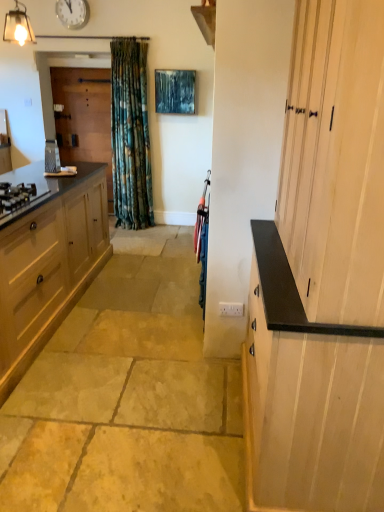
What are the coordinates of `metallic silver grater at left` in the screenshot? It's located at (52, 157).

Measure the distance between point (262, 339) and camera.

1.75 meters.

This screenshot has height=512, width=384. What do you see at coordinates (84, 117) in the screenshot?
I see `wooden screen door at left` at bounding box center [84, 117].

This screenshot has height=512, width=384. What do you see at coordinates (18, 197) in the screenshot?
I see `matte black gas stove at left` at bounding box center [18, 197].

Describe the element at coordinates (127, 397) in the screenshot. I see `natural stone floor at center` at that location.

Find the location of a particular element. The height and width of the screenshot is (512, 384). metallic silver grater at left is located at coordinates (52, 157).

How distant is metallic silver grater at left from matte glass light fixture at upper left?

metallic silver grater at left and matte glass light fixture at upper left are 32.68 inches apart from each other.

Is point (52, 141) closer or farther from the camera than point (10, 40)?

Point (52, 141) is farther from the camera than point (10, 40).

The width and height of the screenshot is (384, 512). Identify the location of appliance on the right of matte glass light fixture at upper left. (52, 157).

Would you consider metallic silver grater at left to be distant from matte glass light fixture at upper left?

Actually, metallic silver grater at left and matte glass light fixture at upper left are a little close together.

Is matte wood cabinet at left, arranged as the 2th cabinetry when viewed from the right, positioned beyond the bounds of natural stone floor at center?

Absolutely, matte wood cabinet at left, arranged as the 2th cabinetry when viewed from the right, is external to natural stone floor at center.

Which of these two, matte wood cabinet at left, the 1th cabinetry in the left-to-right sequence, or natural stone floor at center, is wider?

natural stone floor at center.

Could you tell me if matte wood cabinet at left, arranged as the 2th cabinetry when viewed from the right, is facing natural stone floor at center?

Yes, matte wood cabinet at left, arranged as the 2th cabinetry when viewed from the right, is facing natural stone floor at center.

Would you say matte wood cabinet at left, the 1th cabinetry in the left-to-right sequence, is to the left or to the right of natural stone floor at center in the picture?

Based on their positions, matte wood cabinet at left, the 1th cabinetry in the left-to-right sequence, is located to the left of natural stone floor at center.

From the image's perspective, between matte wood cabinet at left, the 1th cabinetry in the left-to-right sequence, and metallic silver grater at left, which one is located above?

metallic silver grater at left is shown above in the image.

Is matte wood cabinet at left, the 1th cabinetry in the left-to-right sequence, taller than metallic silver grater at left?

Yes.

From a real-world perspective, which is physically above, matte wood cabinet at left, the 1th cabinetry in the left-to-right sequence, or metallic silver grater at left?

In real-world perspective, metallic silver grater at left is above.

Could you tell me if matte wood cabinet at left, arranged as the 2th cabinetry when viewed from the right, is facing metallic silver grater at left?

No, matte wood cabinet at left, arranged as the 2th cabinetry when viewed from the right, is not oriented towards metallic silver grater at left.

Considering the sizes of objects wooden screen door at left and natural stone floor at center in the image provided, who is bigger, wooden screen door at left or natural stone floor at center?

natural stone floor at center.

Considering the positions of objects wooden screen door at left and natural stone floor at center in the image provided, who is in front, wooden screen door at left or natural stone floor at center?

natural stone floor at center.

Which object is positioned more to the left, wooden screen door at left or natural stone floor at center?

wooden screen door at left.

Between matte glass light fixture at upper left and wooden screen door at left, which one has more height?

wooden screen door at left.

Is matte glass light fixture at upper left oriented towards wooden screen door at left?

No, matte glass light fixture at upper left is not turned towards wooden screen door at left.

Looking at this image, is the position of matte glass light fixture at upper left more distant than that of wooden screen door at left?

That is False.

Between matte black gas stove at left and light wood cabinet at right, which is counted as the 2th cabinetry, starting from the left, which one has larger size?

light wood cabinet at right, which is counted as the 2th cabinetry, starting from the left.

Can you tell me how much matte black gas stove at left and light wood cabinet at right, which is counted as the 2th cabinetry, starting from the left, differ in facing direction?

The facing directions of matte black gas stove at left and light wood cabinet at right, which is counted as the 2th cabinetry, starting from the left, are 179 degrees apart.

Would you consider matte black gas stove at left to be distant from light wood cabinet at right, the 1th cabinetry from the right?

That's right, there is a large distance between matte black gas stove at left and light wood cabinet at right, the 1th cabinetry from the right.

Is matte black gas stove at left oriented away from light wood cabinet at right, the 1th cabinetry from the right?

matte black gas stove at left is not turned away from light wood cabinet at right, the 1th cabinetry from the right.

Who is more distant, light wood cabinet at right, the 1th cabinetry from the right, or matte wood cabinet at left, arranged as the 2th cabinetry when viewed from the right?

matte wood cabinet at left, arranged as the 2th cabinetry when viewed from the right, is more distant.

Between light wood cabinet at right, which is counted as the 2th cabinetry, starting from the left, and matte wood cabinet at left, arranged as the 2th cabinetry when viewed from the right, which one appears on the right side from the viewer's perspective?

light wood cabinet at right, which is counted as the 2th cabinetry, starting from the left.

Is point (302, 259) farther from camera compared to point (105, 208)?

No.

From a real-world perspective, between light wood cabinet at right, which is counted as the 2th cabinetry, starting from the left, and matte wood cabinet at left, arranged as the 2th cabinetry when viewed from the right, who is vertically lower?

In real-world perspective, matte wood cabinet at left, arranged as the 2th cabinetry when viewed from the right, is lower.

Where is `light fixture above the metallic silver grater at left (from a real-world perspective)`? This screenshot has width=384, height=512. light fixture above the metallic silver grater at left (from a real-world perspective) is located at coordinates (18, 26).

Find the location of a particular element. The width and height of the screenshot is (384, 512). concrete that appears below the matte wood cabinet at left, arranged as the 2th cabinetry when viewed from the right (from the image's perspective) is located at coordinates (127, 397).

From the image, which object appears to be farther from matte wood cabinet at left, arranged as the 2th cabinetry when viewed from the right, matte glass light fixture at upper left or metallic silver grater at left?

matte glass light fixture at upper left is positioned further to the anchor matte wood cabinet at left, arranged as the 2th cabinetry when viewed from the right.

Estimate the real-world distances between objects in this image. Which object is closer to matte black gas stove at left, metallic silver grater at left or wooden screen door at left?

Among the two, metallic silver grater at left is located nearer to matte black gas stove at left.

From the image, which object appears to be farther from wooden screen door at left, matte black gas stove at left or natural stone floor at center?

Based on the image, natural stone floor at center appears to be further to wooden screen door at left.

Based on the photo, considering their positions, is metallic silver grater at left positioned closer to white glossy clock at upper center than matte glass light fixture at upper left?

Among the two, matte glass light fixture at upper left is located nearer to white glossy clock at upper center.

Considering their positions, is matte black gas stove at left positioned closer to white glossy clock at upper center than matte glass light fixture at upper left?

matte glass light fixture at upper left lies closer to white glossy clock at upper center than the other object.

Which object lies further to the anchor point matte wood cabinet at left, arranged as the 2th cabinetry when viewed from the right, light wood cabinet at right, which is counted as the 2th cabinetry, starting from the left, or matte glass light fixture at upper left?

Among the two, light wood cabinet at right, which is counted as the 2th cabinetry, starting from the left, is located further to matte wood cabinet at left, arranged as the 2th cabinetry when viewed from the right.

Based on their spatial positions, is natural stone floor at center or wooden screen door at left further from matte wood cabinet at left, the 1th cabinetry in the left-to-right sequence?

Based on the image, wooden screen door at left appears to be further to matte wood cabinet at left, the 1th cabinetry in the left-to-right sequence.

From the image, which object appears to be nearer to white glossy clock at upper center, matte glass light fixture at upper left or metallic silver grater at left?

Among the two, matte glass light fixture at upper left is located nearer to white glossy clock at upper center.

Where is `concrete situated between matte wood cabinet at left, the 1th cabinetry in the left-to-right sequence, and light wood cabinet at right, which is counted as the 2th cabinetry, starting from the left, from left to right`? Image resolution: width=384 pixels, height=512 pixels. concrete situated between matte wood cabinet at left, the 1th cabinetry in the left-to-right sequence, and light wood cabinet at right, which is counted as the 2th cabinetry, starting from the left, from left to right is located at coordinates (127, 397).

Where is `cabinetry located between light wood cabinet at right, the 1th cabinetry from the right, and metallic silver grater at left in the depth direction`? The width and height of the screenshot is (384, 512). cabinetry located between light wood cabinet at right, the 1th cabinetry from the right, and metallic silver grater at left in the depth direction is located at coordinates (49, 266).

Identify the location of gas stove between natural stone floor at center and wooden screen door at left from front to back. The height and width of the screenshot is (512, 384). (18, 197).

The image size is (384, 512). In order to click on gas stove between natural stone floor at center and metallic silver grater at left from front to back in this screenshot , I will do `click(18, 197)`.